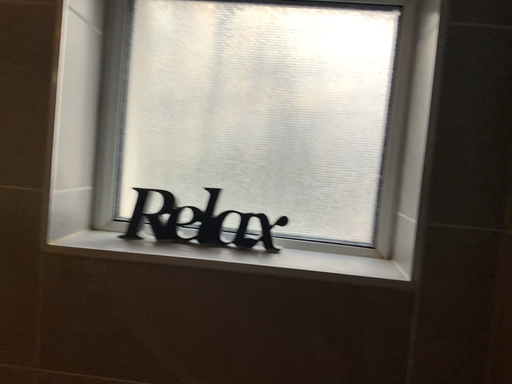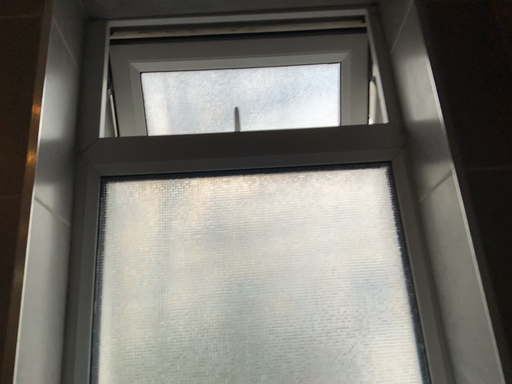
Question: How did the camera likely rotate when shooting the video?

Choices:
 (A) rotated upward
 (B) rotated downward

Answer: (A)